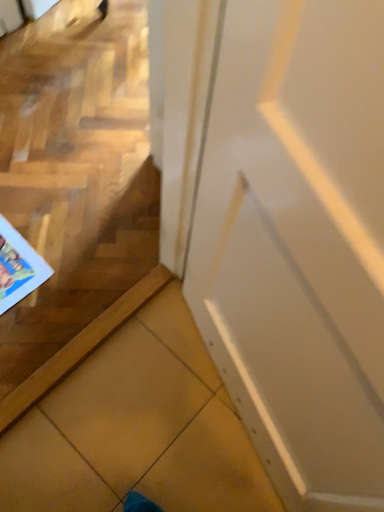
Image resolution: width=384 pixels, height=512 pixels. Find the location of `empty space that is ontop of matte paper comic book at lower left`. empty space that is ontop of matte paper comic book at lower left is located at coordinates (11, 261).